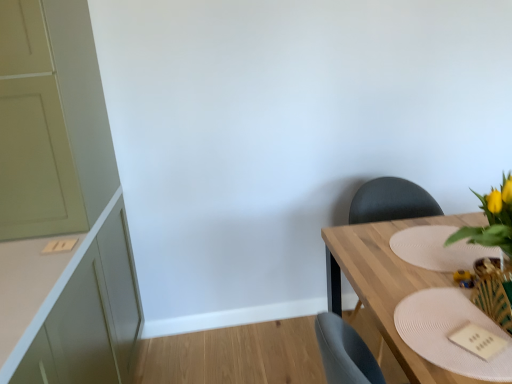
At what (x,y) coordinates should I click in order to perform the action: click on blank space to the left of white textured placemat at right, the 1th plate in the top-to-bottom sequence. Please return your answer as a coordinate pair (x, y). This screenshot has height=384, width=512. Looking at the image, I should click on (366, 256).